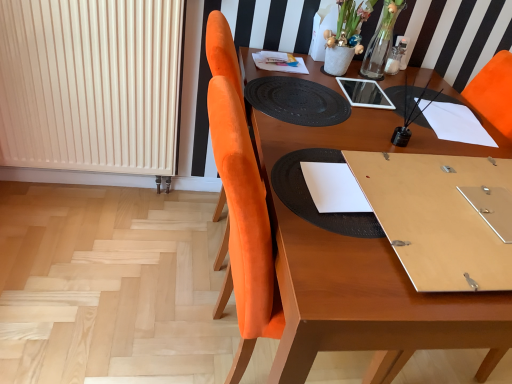
At what (x,y) coordinates should I click in order to perform the action: click on vacant space to the right of black textured placemat at center. Please return your answer as a coordinate pair (x, y). This screenshot has height=384, width=512. Looking at the image, I should click on (426, 203).